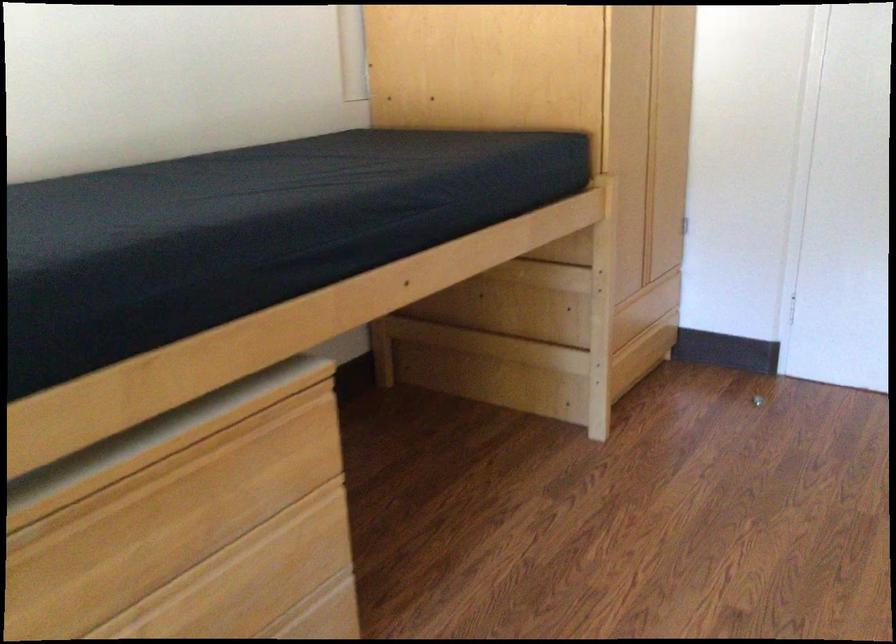
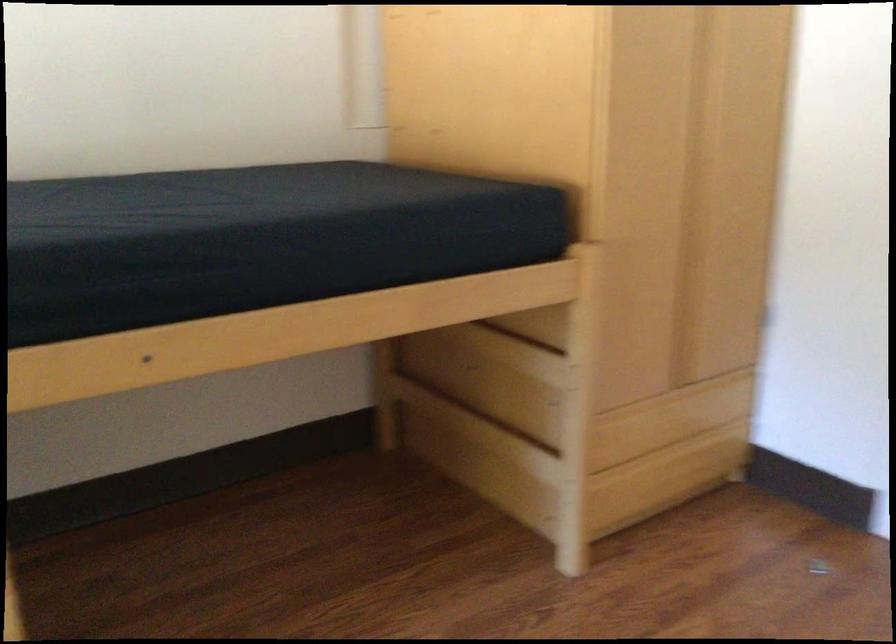
Question: The camera is either moving clockwise (left) or counter-clockwise (right) around the object. The first image is from the beginning of the video and the second image is from the end. Is the camera moving left or right when shooting the video?

Choices:
 (A) Left
 (B) Right

Answer: (B)